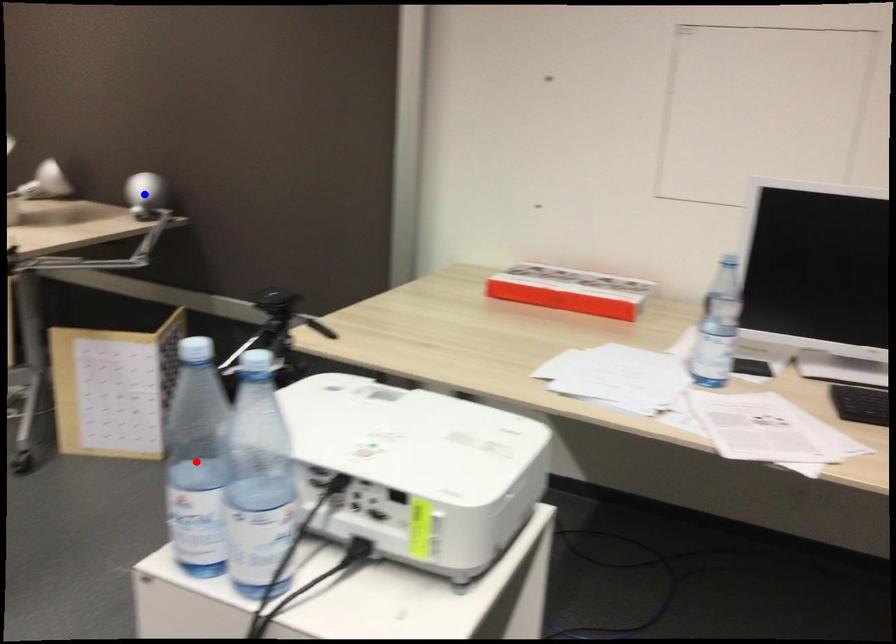
Question: Which of the two points in the image is closer to the camera?

Choices:
 (A) Blue point is closer.
 (B) Red point is closer.

Answer: (B)